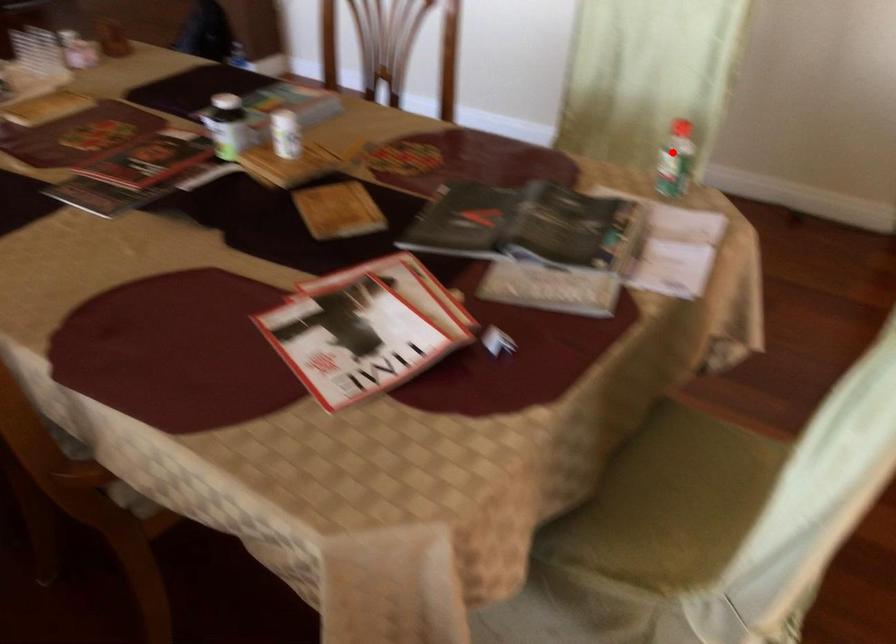
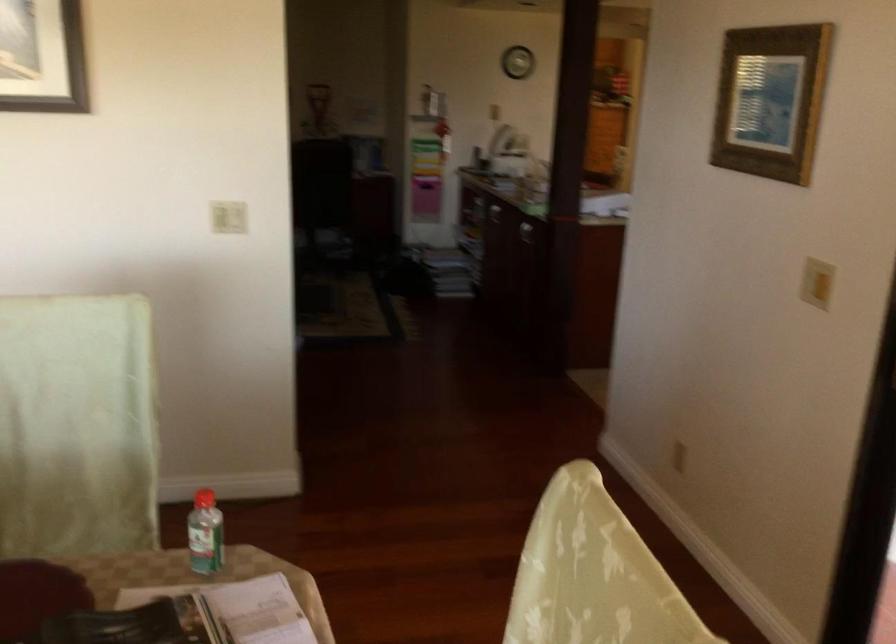
Question: I am providing you with two images of the same scene from different viewpoints. In image1, a red point is highlighted. Considering the same 3D point in image2, which of the following is correct?

Choices:
 (A) It is closer
 (B) It is farther

Answer: (A)